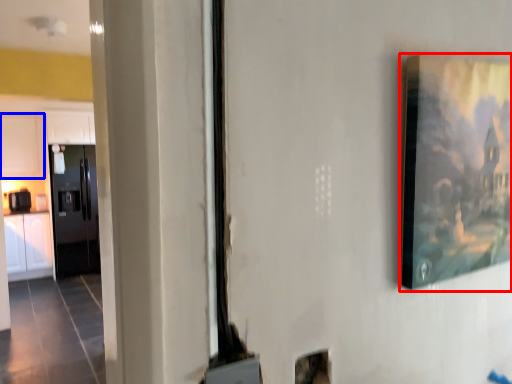
Question: Which object appears farthest to the camera in this image, picture frame (highlighted by a red box) or cabinetry (highlighted by a blue box)?

Choices:
 (A) picture frame
 (B) cabinetry

Answer: (B)